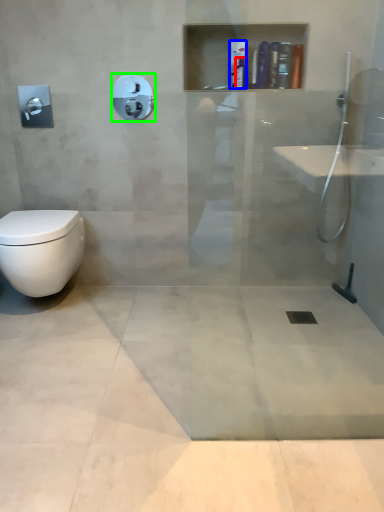
Question: Which object is positioned closest to toiletry (highlighted by a red box)? Select from toiletry (highlighted by a blue box) and shower (highlighted by a green box).

Choices:
 (A) toiletry
 (B) shower

Answer: (A)